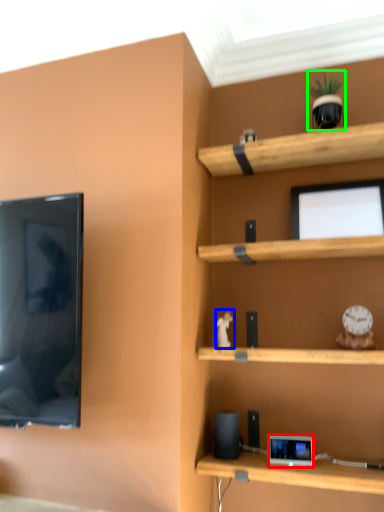
Question: Considering the real-world distances, which object is closest to gadget (highlighted by a red box)? toy (highlighted by a blue box) or toy (highlighted by a green box).

Choices:
 (A) toy
 (B) toy

Answer: (A)